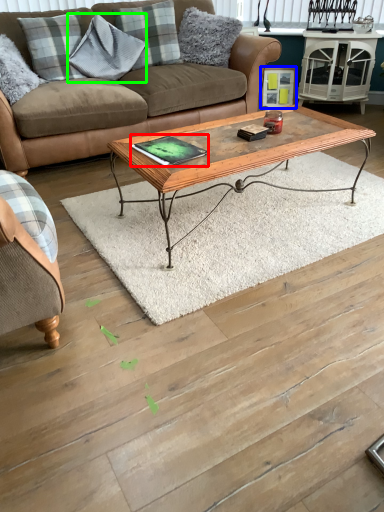
Question: Based on their relative distances, which object is farther from pad (highlighted by a red box)? Choose from picture frame (highlighted by a blue box) and pillow (highlighted by a green box).

Choices:
 (A) picture frame
 (B) pillow

Answer: (A)